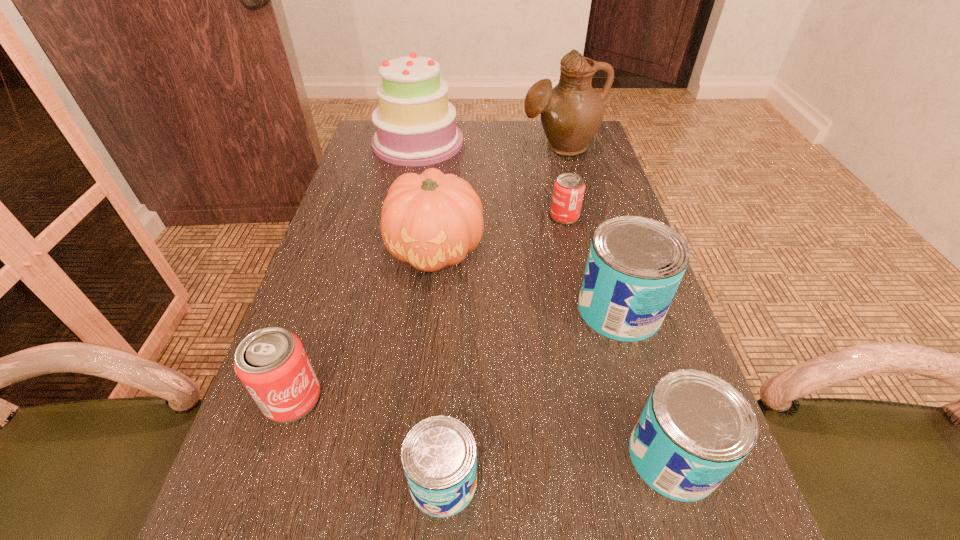
Locate an element on the screen. Image resolution: width=960 pixels, height=540 pixels. pitcher at the far edge is located at coordinates (571, 113).

Image resolution: width=960 pixels, height=540 pixels. What are the coordinates of `cake that is positioned at the far edge` in the screenshot? It's located at (415, 123).

Locate an element on the screen. This screenshot has width=960, height=540. cake that is at the left edge is located at coordinates (415, 123).

The height and width of the screenshot is (540, 960). What are the coordinates of `pumpkin present at the left edge` in the screenshot? It's located at (432, 220).

Find the location of a particular element. The image size is (960, 540). can situated at the left edge is located at coordinates (272, 364).

The image size is (960, 540). I want to click on pitcher present at the right edge, so click(571, 113).

Find the location of a particular element. This screenshot has width=960, height=540. object located in the far left corner section of the desktop is located at coordinates (415, 123).

Find the location of a particular element. Image resolution: width=960 pixels, height=540 pixels. object that is positioned at the far right corner is located at coordinates (571, 113).

The image size is (960, 540). In order to click on free space at the left edge in this screenshot , I will do `click(337, 310)`.

The width and height of the screenshot is (960, 540). Find the location of `vacant space at the right edge of the desktop`. vacant space at the right edge of the desktop is located at coordinates (577, 264).